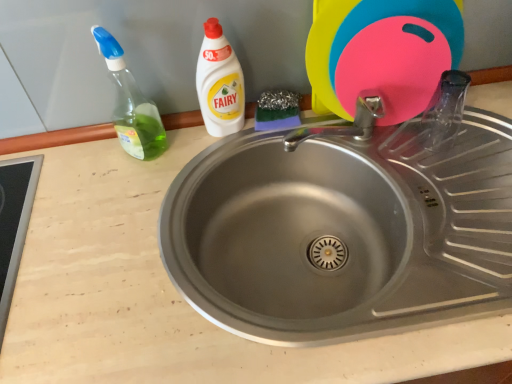
Find the location of a particular element. unoccupied region to the right of white plastic bottle at upper center is located at coordinates (291, 134).